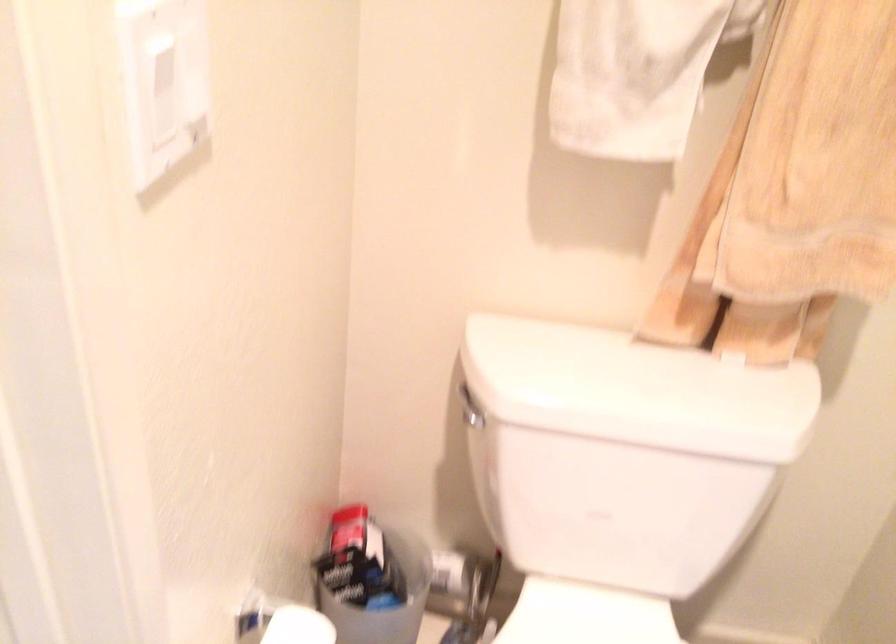
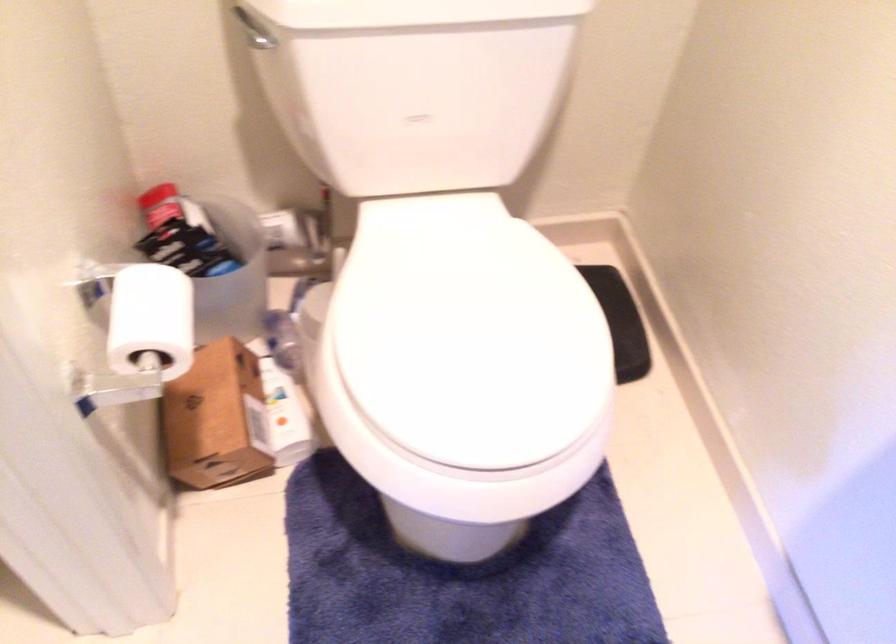
Locate, in the second image, the point that corresponds to (x=345, y=516) in the first image.

(159, 205)